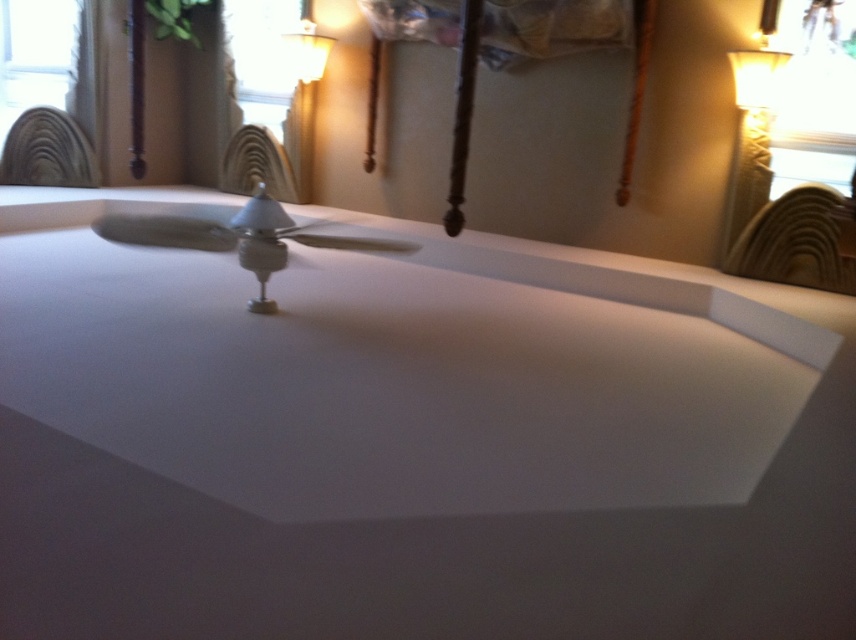
Does white ceramic lampshade at upper right lie in front of matte white lampshade at upper center?

Yes, white ceramic lampshade at upper right is closer to the viewer.

Between point (770, 120) and point (311, 51), which one is positioned behind?

Point (311, 51)

Find the location of a particular element. The width and height of the screenshot is (856, 640). white ceramic lampshade at upper right is located at coordinates (752, 132).

How distant is white glossy table at center from matte white lampshade at upper center?

The distance of white glossy table at center from matte white lampshade at upper center is 7.78 feet.

Can you confirm if white glossy table at center is positioned above matte white lampshade at upper center?

No, white glossy table at center is not above matte white lampshade at upper center.

This screenshot has height=640, width=856. Identify the location of white glossy table at center. (409, 442).

Find the location of a particular element. This screenshot has height=640, width=856. white glossy table at center is located at coordinates (409, 442).

Is the position of white glossy table at center more distant than that of white ceramic lampshade at upper right?

No, it is in front of white ceramic lampshade at upper right.

Between point (833, 356) and point (758, 99), which one is positioned behind?

Positioned behind is point (758, 99).

Is point (48, 225) closer to camera compared to point (782, 72)?

That is False.

The width and height of the screenshot is (856, 640). Identify the location of white glossy table at center. (409, 442).